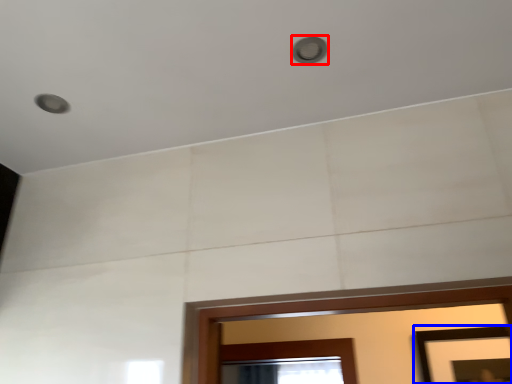
Question: Among these objects, which one is nearest to the camera, light (highlighted by a red box) or picture frame (highlighted by a blue box)?

Choices:
 (A) light
 (B) picture frame

Answer: (A)